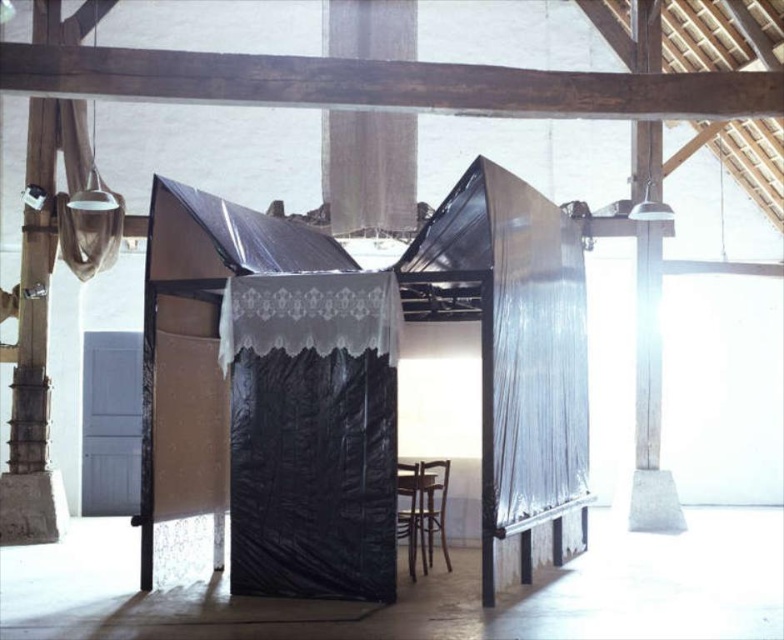
Based on the photo, you are standing in the middle of the room and want to hang a picture on the wall above the black plastic canopy bed at center. Is there enough space between the bed and the white lace curtain at upper left to hang the picture without it touching either?

The black plastic canopy bed at center is below the white lace curtain at upper left, so there is space between them. You can hang the picture in the gap between the bed and the curtain.

From the picture: You are planning to set up a temporary shelter in this room and have a limited amount of space. Given the sizes of the black plastic canopy bed at center and the white lace curtain at upper left, which object would require more space to accommodate?

The black plastic canopy bed at center requires more space because it has a larger size compared to the white lace curtain at upper left.

You are an interior designer assessing the placement of the black lace curtain at center and the white lace curtain at upper left. Based on their positions, which curtain is positioned lower in the scene?

The black lace curtain at center is below the white lace curtain at upper left, so the black lace curtain at center is positioned lower in the scene.